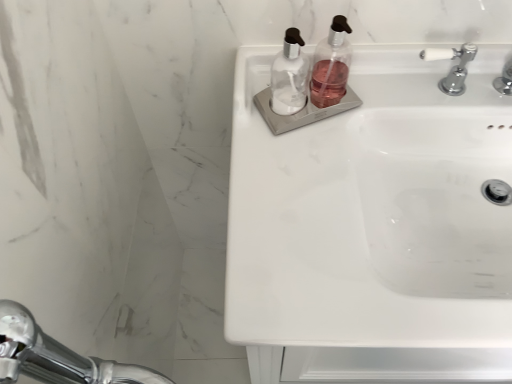
What do you see at coordinates (361, 205) in the screenshot?
I see `white glossy sink at upper right` at bounding box center [361, 205].

Image resolution: width=512 pixels, height=384 pixels. Find the location of `transparent plastic soap dispenser at center, which is the 1th soap dispenser from left to right`. transparent plastic soap dispenser at center, which is the 1th soap dispenser from left to right is located at coordinates (289, 75).

Locate an element on the screen. The width and height of the screenshot is (512, 384). transparent plastic soap dispenser at upper center, which ranks as the second soap dispenser in left-to-right order is located at coordinates (331, 65).

Measure the distance between point (x=330, y=73) and camera.

They are 31.50 inches apart.

The height and width of the screenshot is (384, 512). Identify the location of white glossy sink at upper right. (361, 205).

How many degrees apart are the facing directions of white ceramic tap at upper right and white glossy sink at upper right?

The facing directions of white ceramic tap at upper right and white glossy sink at upper right are 0.214 degrees apart.

Which object is more forward, white ceramic tap at upper right or white glossy sink at upper right?

white glossy sink at upper right is more forward.

From their relative heights in the image, would you say white ceramic tap at upper right is taller or shorter than white glossy sink at upper right?

In the image, white ceramic tap at upper right appears to be shorter than white glossy sink at upper right.

Can you confirm if white glossy sink at upper right is positioned to the left of transparent plastic soap dispenser at upper center, marked as the 1th soap dispenser in a right-to-left arrangement?

In fact, white glossy sink at upper right is to the right of transparent plastic soap dispenser at upper center, marked as the 1th soap dispenser in a right-to-left arrangement.

Does white glossy sink at upper right touch transparent plastic soap dispenser at upper center, marked as the 1th soap dispenser in a right-to-left arrangement?

They are not placed beside each other.

In the scene shown: Considering the sizes of objects white glossy sink at upper right and transparent plastic soap dispenser at upper center, marked as the 1th soap dispenser in a right-to-left arrangement, in the image provided, who is taller, white glossy sink at upper right or transparent plastic soap dispenser at upper center, marked as the 1th soap dispenser in a right-to-left arrangement,?

white glossy sink at upper right.

Does point (337, 154) come closer to viewer compared to point (316, 101)?

Yes, it is in front of point (316, 101).

Does white ceramic tap at upper right have a lesser height compared to transparent plastic soap dispenser at upper center, marked as the 1th soap dispenser in a right-to-left arrangement?

Yes, white ceramic tap at upper right is shorter than transparent plastic soap dispenser at upper center, marked as the 1th soap dispenser in a right-to-left arrangement.

Does point (429, 57) appear closer or farther from the camera than point (336, 41)?

Clearly, point (429, 57) is more distant from the camera than point (336, 41).

Who is more distant, white ceramic tap at upper right or transparent plastic soap dispenser at upper center, which ranks as the second soap dispenser in left-to-right order?

white ceramic tap at upper right is more distant.

Is white ceramic tap at upper right not inside transparent plastic soap dispenser at upper center, marked as the 1th soap dispenser in a right-to-left arrangement?

Yes, white ceramic tap at upper right is not within transparent plastic soap dispenser at upper center, marked as the 1th soap dispenser in a right-to-left arrangement.

Considering the sizes of white glossy sink at upper right and white ceramic tap at upper right in the image, is white glossy sink at upper right taller or shorter than white ceramic tap at upper right?

In the image, white glossy sink at upper right appears to be taller than white ceramic tap at upper right.

Locate an element on the screen. tap above the white glossy sink at upper right (from a real-world perspective) is located at coordinates (453, 66).

How many degrees apart are the facing directions of white glossy sink at upper right and white ceramic tap at upper right?

The angle between the facing direction of white glossy sink at upper right and the facing direction of white ceramic tap at upper right is 0.214 degrees.

Is white ceramic tap at upper right at the back of white glossy sink at upper right?

white glossy sink at upper right does not have its back to white ceramic tap at upper right.

Who is shorter, transparent plastic soap dispenser at upper center, marked as the 1th soap dispenser in a right-to-left arrangement, or white glossy sink at upper right?

transparent plastic soap dispenser at upper center, marked as the 1th soap dispenser in a right-to-left arrangement, is shorter.

Is transparent plastic soap dispenser at upper center, marked as the 1th soap dispenser in a right-to-left arrangement, placed right next to white glossy sink at upper right?

transparent plastic soap dispenser at upper center, marked as the 1th soap dispenser in a right-to-left arrangement, is not next to white glossy sink at upper right, and they're not touching.

From a real-world perspective, which object rests below the other?

white glossy sink at upper right.

In terms of width, does transparent plastic soap dispenser at upper center, which ranks as the second soap dispenser in left-to-right order, look wider or thinner when compared to white glossy sink at upper right?

transparent plastic soap dispenser at upper center, which ranks as the second soap dispenser in left-to-right order, is thinner than white glossy sink at upper right.

In the scene shown: Considering the positions of objects transparent plastic soap dispenser at upper center, which ranks as the second soap dispenser in left-to-right order, and transparent plastic soap dispenser at center, the second soap dispenser positioned from the right, in the image provided, who is more to the right, transparent plastic soap dispenser at upper center, which ranks as the second soap dispenser in left-to-right order, or transparent plastic soap dispenser at center, the second soap dispenser positioned from the right,?

Positioned to the right is transparent plastic soap dispenser at upper center, which ranks as the second soap dispenser in left-to-right order.

Considering the relative sizes of transparent plastic soap dispenser at upper center, which ranks as the second soap dispenser in left-to-right order, and transparent plastic soap dispenser at center, the second soap dispenser positioned from the right, in the image provided, is transparent plastic soap dispenser at upper center, which ranks as the second soap dispenser in left-to-right order, taller than transparent plastic soap dispenser at center, the second soap dispenser positioned from the right,?

Incorrect, the height of transparent plastic soap dispenser at upper center, which ranks as the second soap dispenser in left-to-right order, is not larger of that of transparent plastic soap dispenser at center, the second soap dispenser positioned from the right.

Is point (321, 102) closer or farther from the camera than point (291, 60)?

Clearly, point (321, 102) is more distant from the camera than point (291, 60).

Can we say transparent plastic soap dispenser at center, which is the 1th soap dispenser from left to right, lies outside white glossy sink at upper right?

transparent plastic soap dispenser at center, which is the 1th soap dispenser from left to right, lies outside white glossy sink at upper right's area.

From the image's perspective, does transparent plastic soap dispenser at center, which is the 1th soap dispenser from left to right, appear higher than white glossy sink at upper right?

Yes, from the image's perspective, transparent plastic soap dispenser at center, which is the 1th soap dispenser from left to right, is on top of white glossy sink at upper right.

Does transparent plastic soap dispenser at center, which is the 1th soap dispenser from left to right, touch white glossy sink at upper right?

They are not placed beside each other.

Looking at this image, considering their positions, is transparent plastic soap dispenser at center, which is the 1th soap dispenser from left to right, located in front of or behind white glossy sink at upper right?

In the image, transparent plastic soap dispenser at center, which is the 1th soap dispenser from left to right, appears behind white glossy sink at upper right.

The image size is (512, 384). Identify the location of tap above the white glossy sink at upper right (from a real-world perspective). (453, 66).

The width and height of the screenshot is (512, 384). I want to click on sink below the transparent plastic soap dispenser at upper center, which ranks as the second soap dispenser in left-to-right order (from the image's perspective), so click(361, 205).

From the picture: Considering their positions, is white ceramic tap at upper right positioned closer to transparent plastic soap dispenser at upper center, which ranks as the second soap dispenser in left-to-right order, than transparent plastic soap dispenser at center, the second soap dispenser positioned from the right?

Among the two, transparent plastic soap dispenser at center, the second soap dispenser positioned from the right, is located nearer to transparent plastic soap dispenser at upper center, which ranks as the second soap dispenser in left-to-right order.

Based on the photo, which object lies nearer to the anchor point white glossy sink at upper right, transparent plastic soap dispenser at center, which is the 1th soap dispenser from left to right, or white ceramic tap at upper right?

transparent plastic soap dispenser at center, which is the 1th soap dispenser from left to right, is positioned closer to the anchor white glossy sink at upper right.

Based on their spatial positions, is white glossy sink at upper right or white ceramic tap at upper right further from transparent plastic soap dispenser at upper center, marked as the 1th soap dispenser in a right-to-left arrangement?

white glossy sink at upper right lies further to transparent plastic soap dispenser at upper center, marked as the 1th soap dispenser in a right-to-left arrangement, than the other object.

Which object lies further to the anchor point transparent plastic soap dispenser at center, which is the 1th soap dispenser from left to right, white ceramic tap at upper right or white glossy sink at upper right?

Based on the image, white ceramic tap at upper right appears to be further to transparent plastic soap dispenser at center, which is the 1th soap dispenser from left to right.

Looking at the image, which one is located closer to transparent plastic soap dispenser at upper center, which ranks as the second soap dispenser in left-to-right order, white glossy sink at upper right or transparent plastic soap dispenser at center, which is the 1th soap dispenser from left to right?

The object closer to transparent plastic soap dispenser at upper center, which ranks as the second soap dispenser in left-to-right order, is transparent plastic soap dispenser at center, which is the 1th soap dispenser from left to right.

Considering their positions, is transparent plastic soap dispenser at upper center, which ranks as the second soap dispenser in left-to-right order, positioned closer to transparent plastic soap dispenser at center, the second soap dispenser positioned from the right, than white glossy sink at upper right?

transparent plastic soap dispenser at upper center, which ranks as the second soap dispenser in left-to-right order, is positioned closer to the anchor transparent plastic soap dispenser at center, the second soap dispenser positioned from the right.

Considering their positions, is white glossy sink at upper right positioned further to transparent plastic soap dispenser at center, the second soap dispenser positioned from the right, than white ceramic tap at upper right?

white ceramic tap at upper right is positioned further to the anchor transparent plastic soap dispenser at center, the second soap dispenser positioned from the right.

Looking at the image, which one is located closer to white glossy sink at upper right, transparent plastic soap dispenser at upper center, marked as the 1th soap dispenser in a right-to-left arrangement, or transparent plastic soap dispenser at center, the second soap dispenser positioned from the right?

The object closer to white glossy sink at upper right is transparent plastic soap dispenser at center, the second soap dispenser positioned from the right.

Locate an element on the screen. The width and height of the screenshot is (512, 384). soap dispenser situated between transparent plastic soap dispenser at center, the second soap dispenser positioned from the right, and white ceramic tap at upper right from left to right is located at coordinates (331, 65).

The height and width of the screenshot is (384, 512). Identify the location of soap dispenser between transparent plastic soap dispenser at upper center, which ranks as the second soap dispenser in left-to-right order, and white glossy sink at upper right from top to bottom. (289, 75).

This screenshot has width=512, height=384. Find the location of `sink situated between transparent plastic soap dispenser at center, the second soap dispenser positioned from the right, and white ceramic tap at upper right from left to right`. sink situated between transparent plastic soap dispenser at center, the second soap dispenser positioned from the right, and white ceramic tap at upper right from left to right is located at coordinates (361, 205).